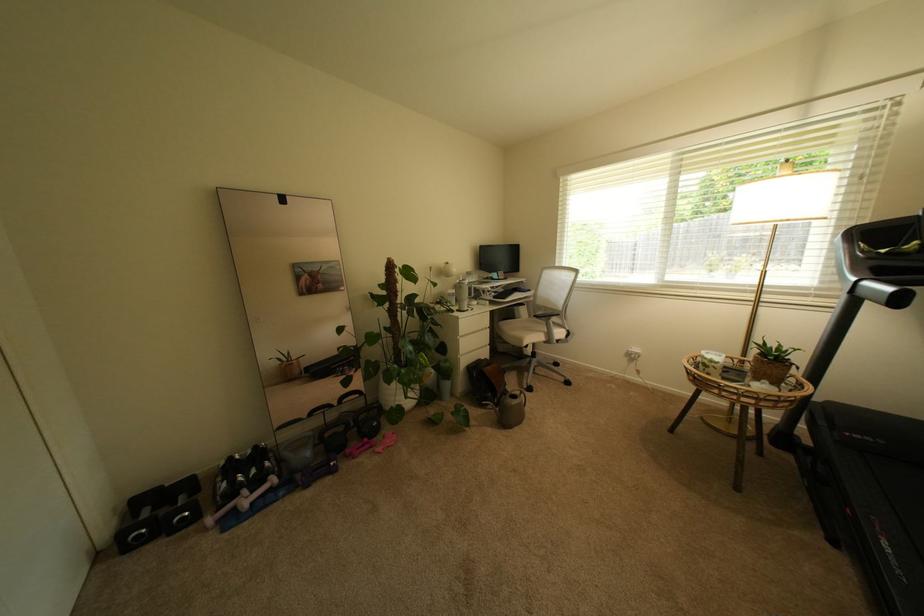
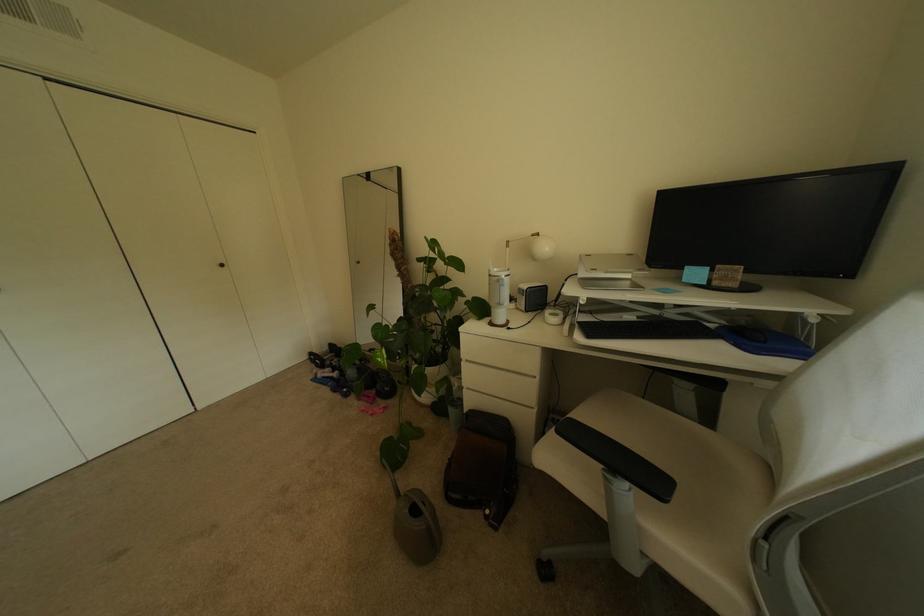
In the second image, find the point that corresponds to point 485,284 in the first image.

(637, 284)